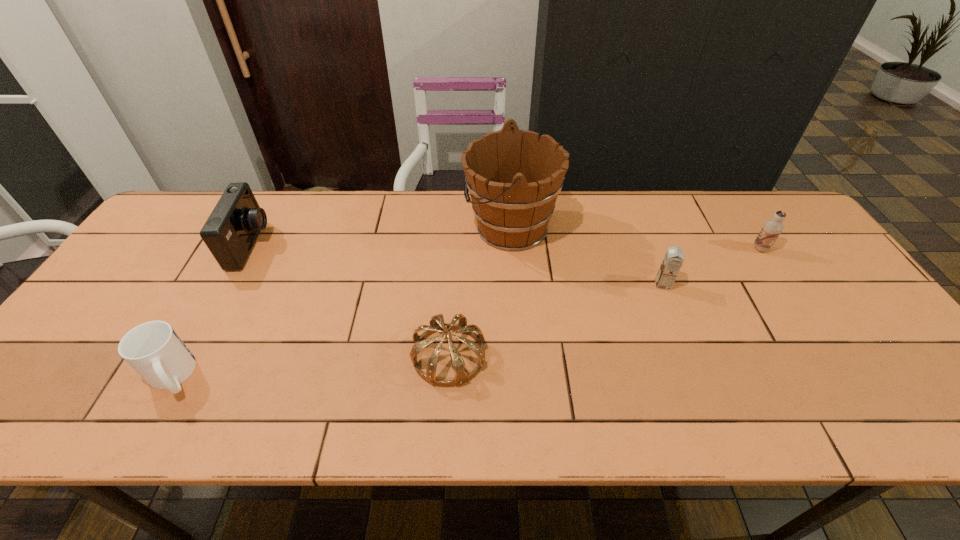
Where is `free space at the far edge of the desktop`? The height and width of the screenshot is (540, 960). free space at the far edge of the desktop is located at coordinates (588, 214).

Where is `free region at the near edge of the desktop`? free region at the near edge of the desktop is located at coordinates (353, 415).

Locate an element on the screen. The height and width of the screenshot is (540, 960). free space at the left edge of the desktop is located at coordinates (191, 254).

The width and height of the screenshot is (960, 540). Find the location of `free space at the right edge`. free space at the right edge is located at coordinates (769, 259).

In order to click on empty space that is in between the tiara and the right chocolate milk in this screenshot , I will do `click(605, 302)`.

Find the location of a particular element. The width and height of the screenshot is (960, 540). free space between the second object from right to left and the right chocolate milk is located at coordinates (711, 267).

Identify the location of vacant space that is in between the wine bucket and the mug. (342, 302).

Identify the location of free space between the nearer chocolate milk and the tiara. The image size is (960, 540). (556, 320).

Where is `free spot between the mug and the tiara`? This screenshot has height=540, width=960. free spot between the mug and the tiara is located at coordinates (311, 366).

I want to click on free point between the camera and the tiara, so point(350,301).